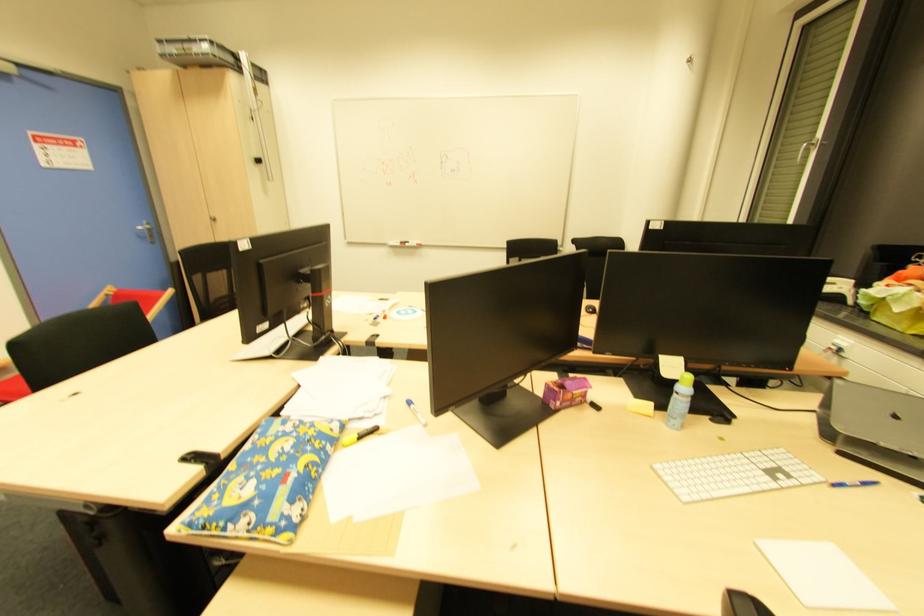
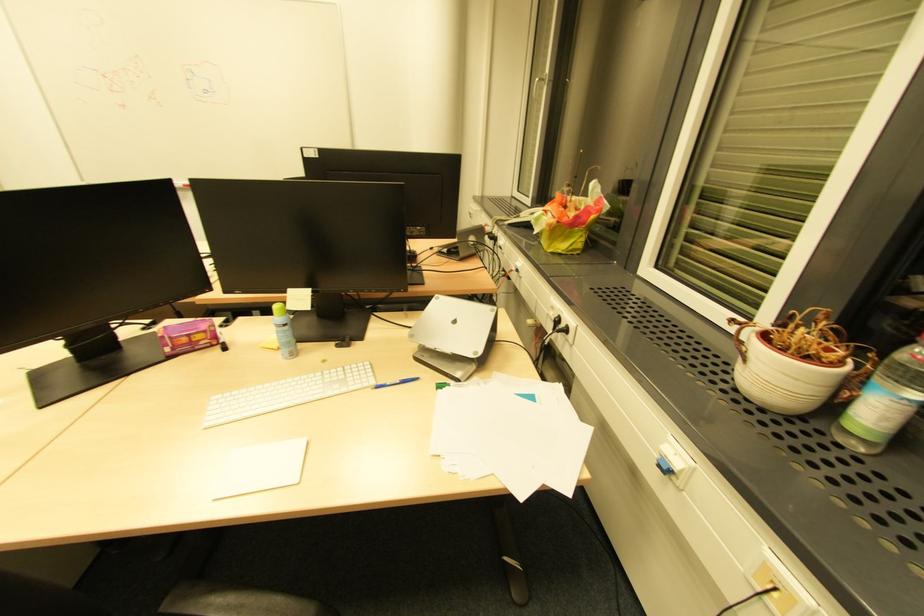
Question: What movement of the cameraman would produce the second image?

Choices:
 (A) Left
 (B) Right
 (C) Forward
 (D) Backward

Answer: (B)